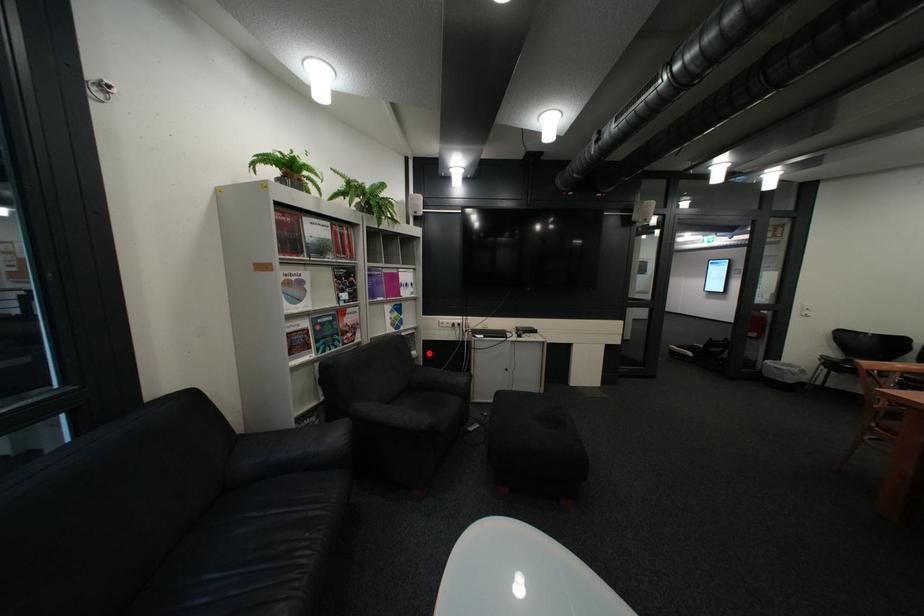
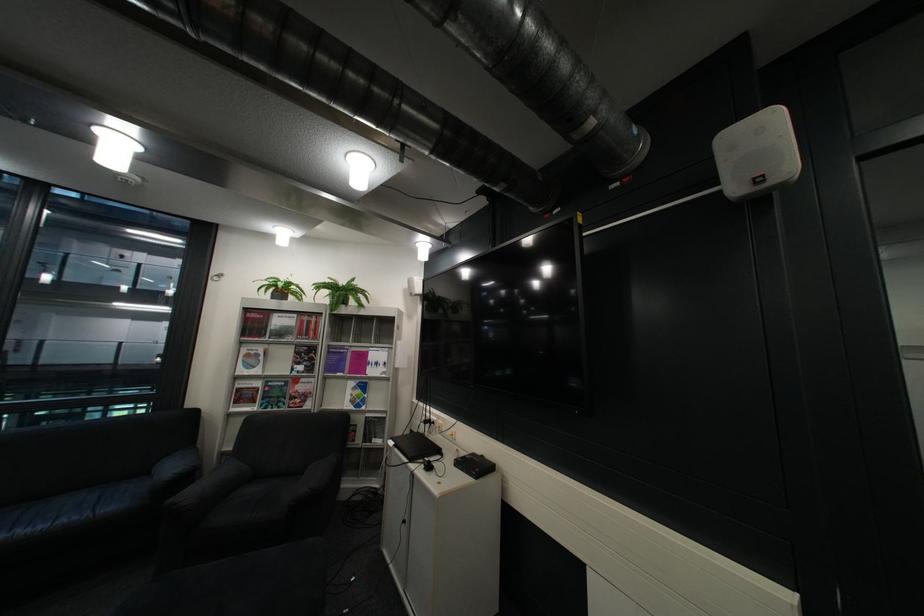
Where in the second image is the point corresponding to the highlighted location from the first image?

(393, 442)